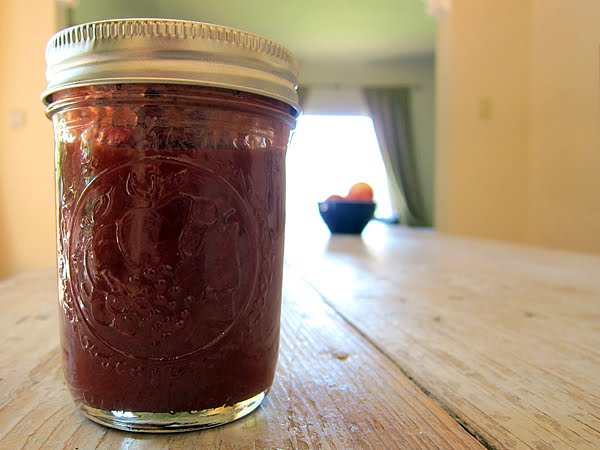
At what (x,y) coordinates should I click in order to perform the action: click on mason jar. Please return your answer as a coordinate pair (x, y). The height and width of the screenshot is (450, 600). Looking at the image, I should click on (228, 277).